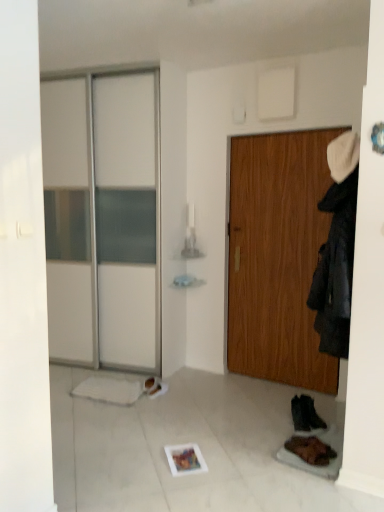
Question: From the image's perspective, does wooden door at center appear lower than dark gray fabric coat at right?

Choices:
 (A) yes
 (B) no

Answer: (A)

Question: Can you confirm if wooden door at center is bigger than dark gray fabric coat at right?

Choices:
 (A) yes
 (B) no

Answer: (B)

Question: Is wooden door at center further to the viewer compared to dark gray fabric coat at right?

Choices:
 (A) no
 (B) yes

Answer: (B)

Question: Is the position of wooden door at center less distant than that of dark gray fabric coat at right?

Choices:
 (A) yes
 (B) no

Answer: (B)

Question: Is wooden door at center beside dark gray fabric coat at right?

Choices:
 (A) yes
 (B) no

Answer: (B)

Question: Can you confirm if wooden door at center is thinner than dark gray fabric coat at right?

Choices:
 (A) no
 (B) yes

Answer: (B)

Question: Is the surface of brown leather boot at lower right, the first footwear viewed from the front, in direct contact with black suede boot at lower right, arranged as the 2th footwear when viewed from the front?

Choices:
 (A) yes
 (B) no

Answer: (B)

Question: Does brown leather boot at lower right, the first footwear viewed from the front, lie in front of black suede boot at lower right, arranged as the 2th footwear when viewed from the front?

Choices:
 (A) yes
 (B) no

Answer: (A)

Question: Does brown leather boot at lower right, the first footwear viewed from the front, have a greater height compared to black suede boot at lower right, arranged as the 2th footwear when viewed from the front?

Choices:
 (A) yes
 (B) no

Answer: (B)

Question: Is brown leather boot at lower right, the first footwear viewed from the front, facing away from black suede boot at lower right, arranged as the 2th footwear when viewed from the front?

Choices:
 (A) no
 (B) yes

Answer: (A)

Question: Is brown leather boot at lower right, the 2th footwear in the back-to-front sequence, far from black suede boot at lower right, positioned as the first footwear in back-to-front order?

Choices:
 (A) yes
 (B) no

Answer: (B)

Question: Considering the relative positions of brown leather boot at lower right, the 2th footwear in the back-to-front sequence, and black suede boot at lower right, arranged as the 2th footwear when viewed from the front, in the image provided, is brown leather boot at lower right, the 2th footwear in the back-to-front sequence, behind black suede boot at lower right, arranged as the 2th footwear when viewed from the front,?

Choices:
 (A) no
 (B) yes

Answer: (A)

Question: Does wooden door at center appear on the right side of brown leather boot at lower right, the first footwear viewed from the front?

Choices:
 (A) yes
 (B) no

Answer: (A)